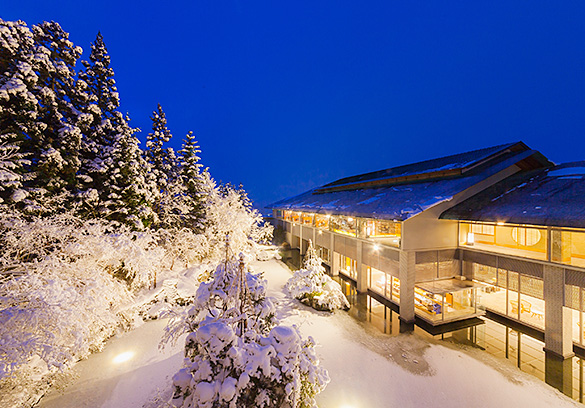
At what (x,y) coordinates should I click in order to perform the action: click on bottom floor. Please return your answer as a coordinate pair (x, y). Looking at the image, I should click on (505, 341).